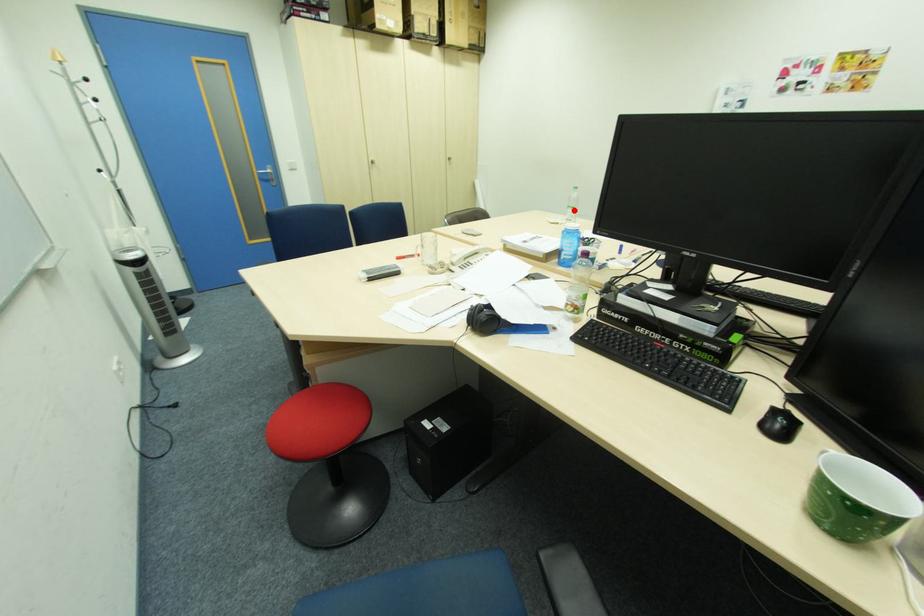
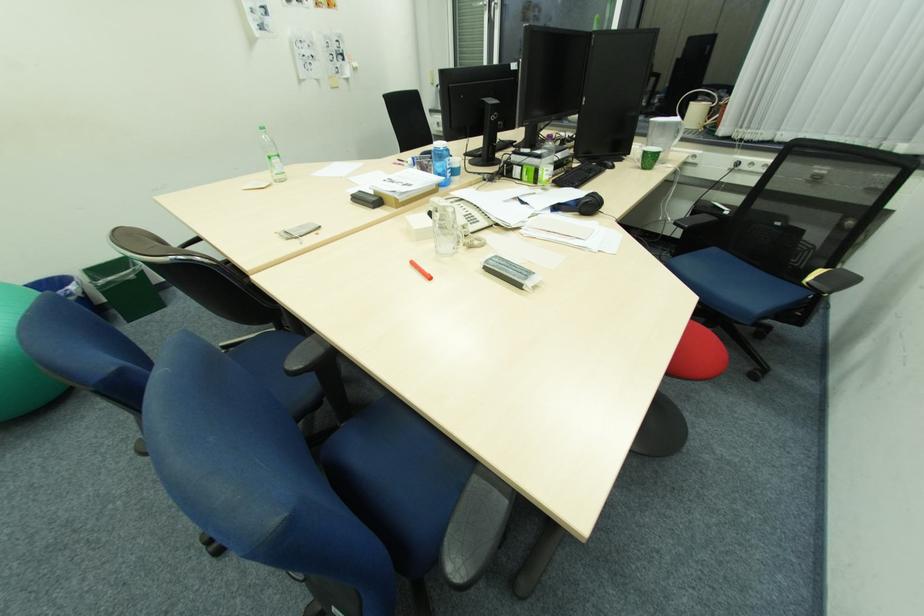
The point at the highlighted location is marked in the first image. Where is the corresponding point in the second image?

(280, 161)